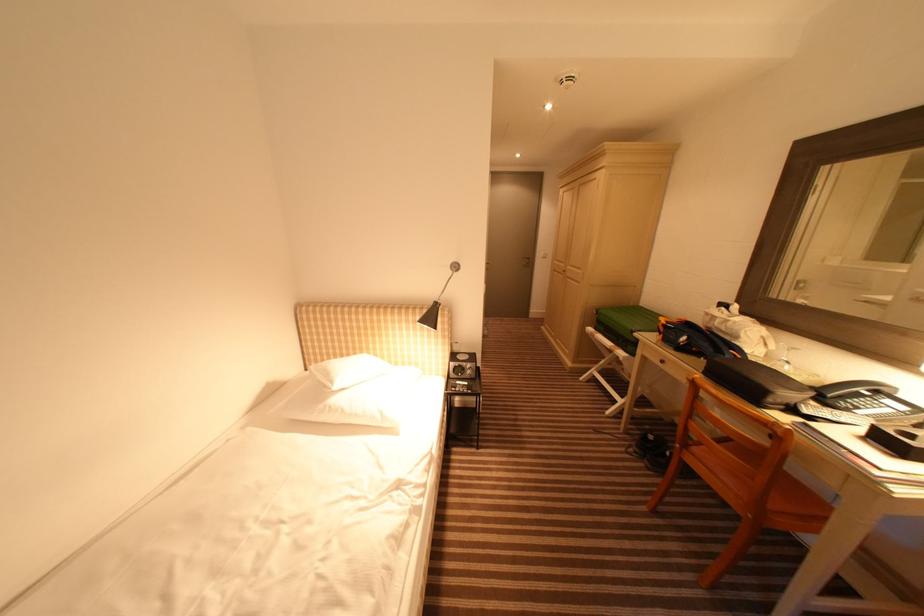
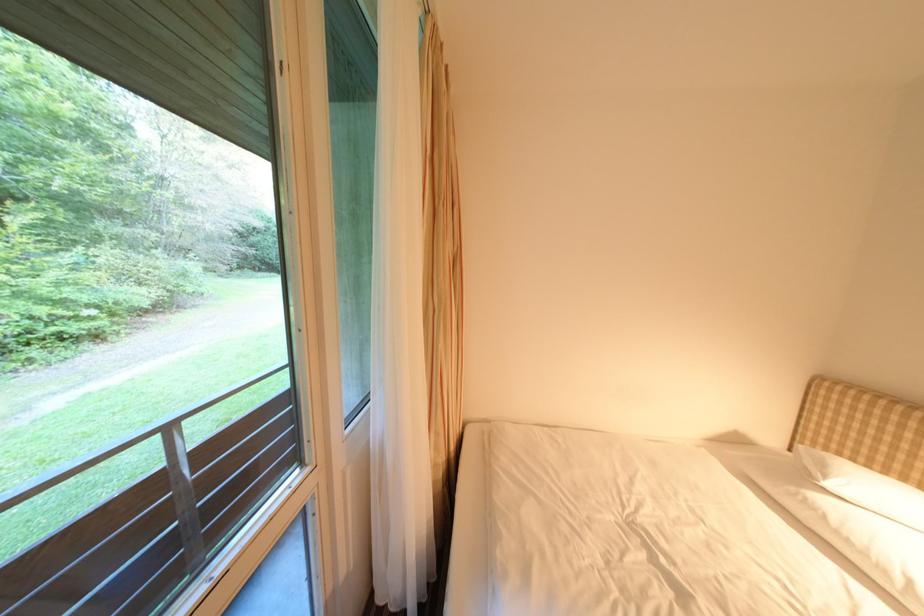
Question: Based on the continuous images, in which direction is the camera rotating? Reply with the corresponding letter.

Choices:
 (A) Left
 (B) Right
 (C) Up
 (D) Down

Answer: (A)